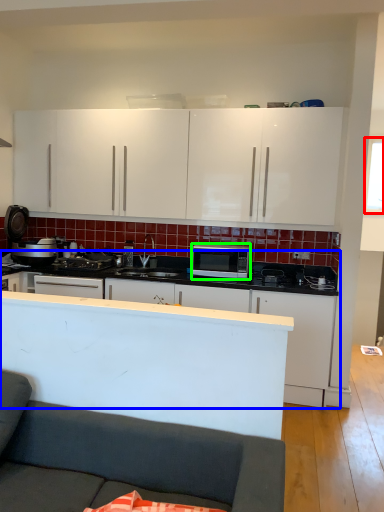
Question: Based on their relative distances, which object is nearer to window screen (highlighted by a red box)? Choose from cabinetry (highlighted by a blue box) and microwave oven (highlighted by a green box).

Choices:
 (A) cabinetry
 (B) microwave oven

Answer: (B)